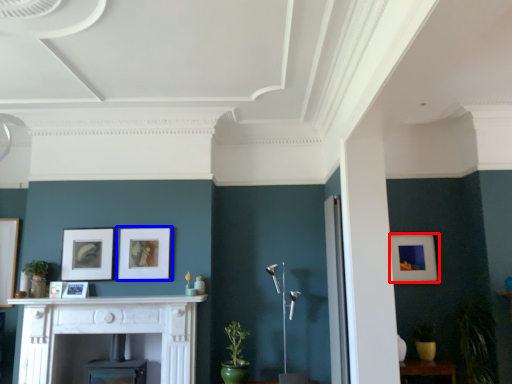
Question: Which of the following is the closest to the observer, picture frame (highlighted by a red box) or picture frame (highlighted by a blue box)?

Choices:
 (A) picture frame
 (B) picture frame

Answer: (B)